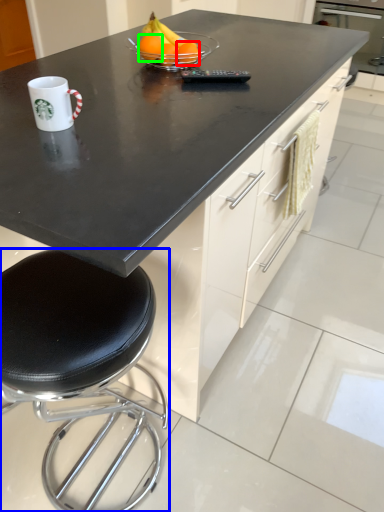
Question: Which is farther away from orange (highlighted by a red box)? stool (highlighted by a blue box) or orange (highlighted by a green box)?

Choices:
 (A) stool
 (B) orange

Answer: (A)